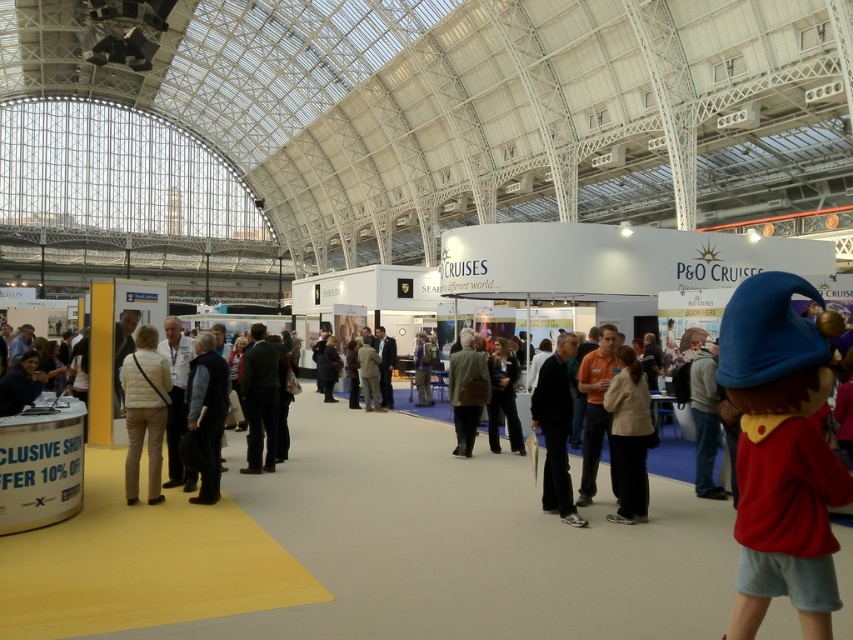
You are an event planner setting up a walkway from the entrance to the central area. The entrance is located to the left of the Paddington Bear character. You need to place a red carpet that must be at least 30 feet long to accommodate the guests. Based on the distance between the entrance and the black fabric pants at center, will the red carpet be long enough?

The distance between the entrance and the black fabric pants at center is 28.40 feet. Since the required red carpet length is 30 feet, the provided carpet is not long enough to cover the distance.